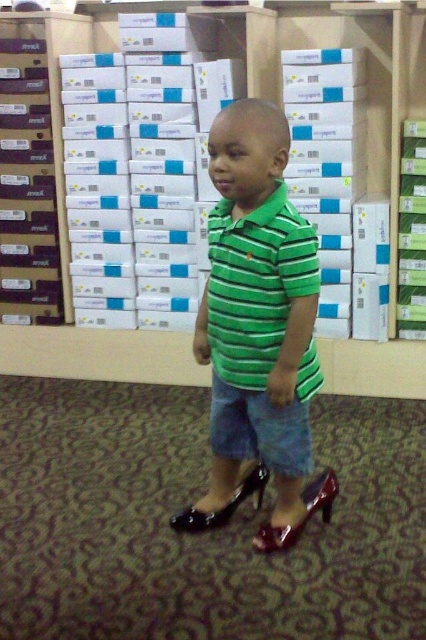
Between point (268, 348) and point (287, 218), which one is positioned in front?

Point (287, 218)

Who is positioned more to the left, green striped shirt at center or green striped polo shirt at center?

From the viewer's perspective, green striped shirt at center appears more on the left side.

Is point (256, 333) less distant than point (210, 353)?

Yes, point (256, 333) is closer to viewer.

Locate an element on the screen. This screenshot has width=426, height=640. green striped shirt at center is located at coordinates (258, 330).

Identify the location of green striped shirt at center. This screenshot has height=640, width=426. (258, 330).

Between green striped shirt at center and shiny black high-heeled shoe at lower center, which one appears on the right side from the viewer's perspective?

green striped shirt at center

Is point (281, 356) behind point (232, 506)?

No.

Find the location of a particular element. The image size is (426, 640). green striped shirt at center is located at coordinates (258, 330).

Is green striped polo shirt at center positioned at the back of shiny burgundy sandal at lower center?

No.

Describe the element at coordinates (256, 284) in the screenshot. I see `green striped polo shirt at center` at that location.

Where is `green striped polo shirt at center`? This screenshot has height=640, width=426. green striped polo shirt at center is located at coordinates (256, 284).